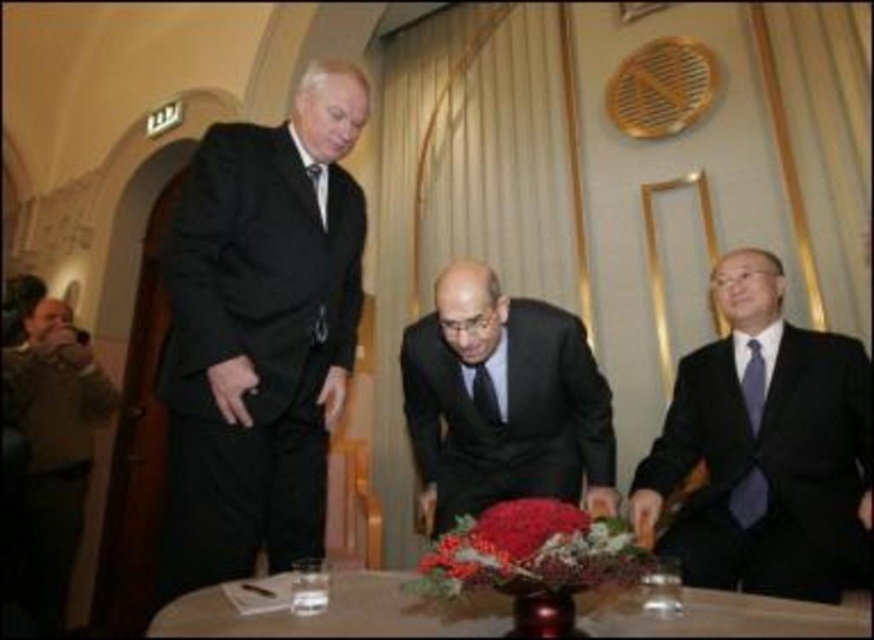
You are a photographer at a formal event. You need to capture a photo of the black matte suit at left and the black silk suit at center. From the photographer perspective, which one is on the left side?

The black matte suit at left is positioned on the left side of the black silk suit at center, so the black matte suit at left is on the left side.

You are a photographer positioned at the back of the room. You want to capture a clear photo of the black matte suit at left without the matte black suit at right blocking it. Is this possible given their positions?

The black matte suit at left is in front of the matte black suit at right, so yes, it is possible to capture a clear photo of the black matte suit at left without obstruction from the matte black suit at right.

You are a photographer at a formal event. You need to capture a closeup of the black silk suit at center without including the black matte suit at left in the frame. Given their sizes, is this possible?

The black matte suit at left is larger in size than the black silk suit at center. Therefore, it might be challenging to frame the black silk suit at center without including the black matte suit at left due to its larger size taking up more space.